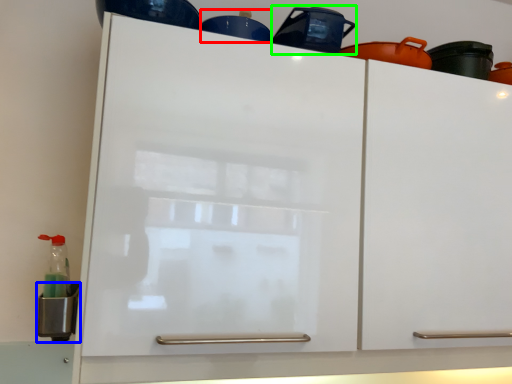
Question: Which is nearer to the appliance (highlighted by a red box)? appliance (highlighted by a blue box) or appliance (highlighted by a green box).

Choices:
 (A) appliance
 (B) appliance

Answer: (B)